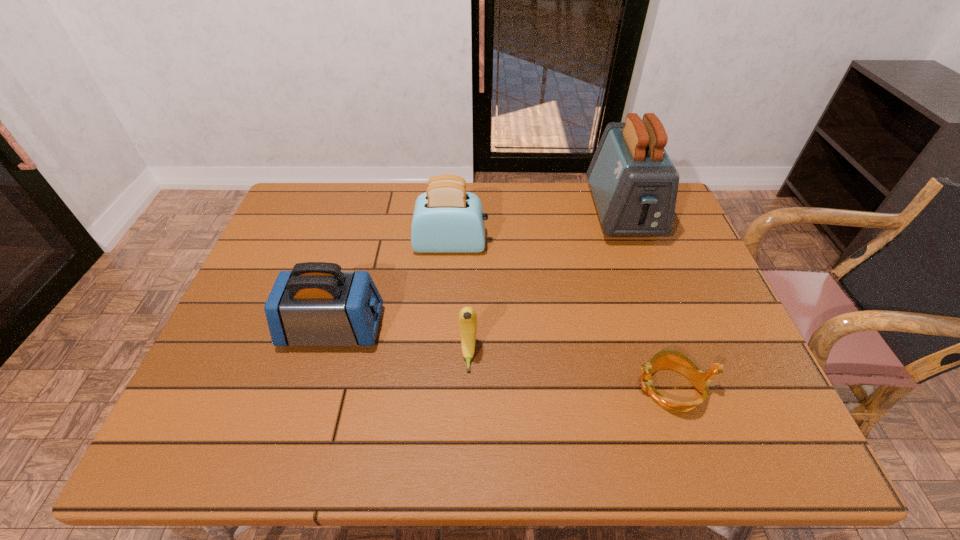
Where is `free space between the leftmost object and the shortest object`? Image resolution: width=960 pixels, height=540 pixels. free space between the leftmost object and the shortest object is located at coordinates (502, 359).

Where is `free space between the leftmost object and the banana`? This screenshot has width=960, height=540. free space between the leftmost object and the banana is located at coordinates (401, 342).

Locate an element on the screen. The image size is (960, 540). free spot between the leftmost object and the second toaster from left to right is located at coordinates (392, 287).

Locate an element on the screen. The height and width of the screenshot is (540, 960). vacant area that lies between the shortest object and the leftmost toaster is located at coordinates (502, 359).

Locate an element on the screen. Image resolution: width=960 pixels, height=540 pixels. empty space that is in between the banana and the tiara is located at coordinates (569, 372).

Locate an element on the screen. unoccupied area between the leftmost toaster and the shortest object is located at coordinates (502, 359).

In order to click on free space between the rightmost toaster and the banana in this screenshot , I will do `click(545, 285)`.

Image resolution: width=960 pixels, height=540 pixels. Find the location of `object that ranks as the closest to the second shortest object`. object that ranks as the closest to the second shortest object is located at coordinates (316, 304).

Choose which object is the nearest neighbor to the banana. Please provide its 2D coordinates. Your answer should be formatted as a tuple, i.e. [(x, y)], where the tuple contains the x and y coordinates of a point satisfying the conditions above.

[(316, 304)]

Identify which toaster is the second closest to the nearest toaster. Please provide its 2D coordinates. Your answer should be formatted as a tuple, i.e. [(x, y)], where the tuple contains the x and y coordinates of a point satisfying the conditions above.

[(634, 184)]